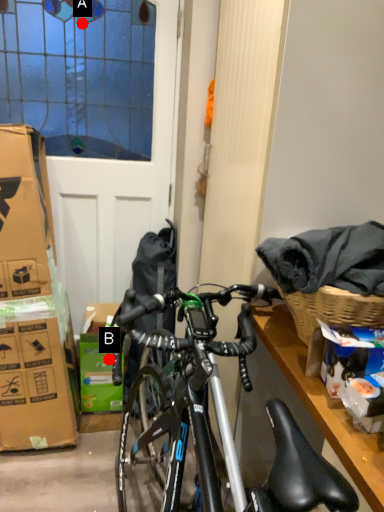
Question: Two points are circled on the image, labeled by A and B beside each circle. Which point is closer to the camera?

Choices:
 (A) A is closer
 (B) B is closer

Answer: (A)